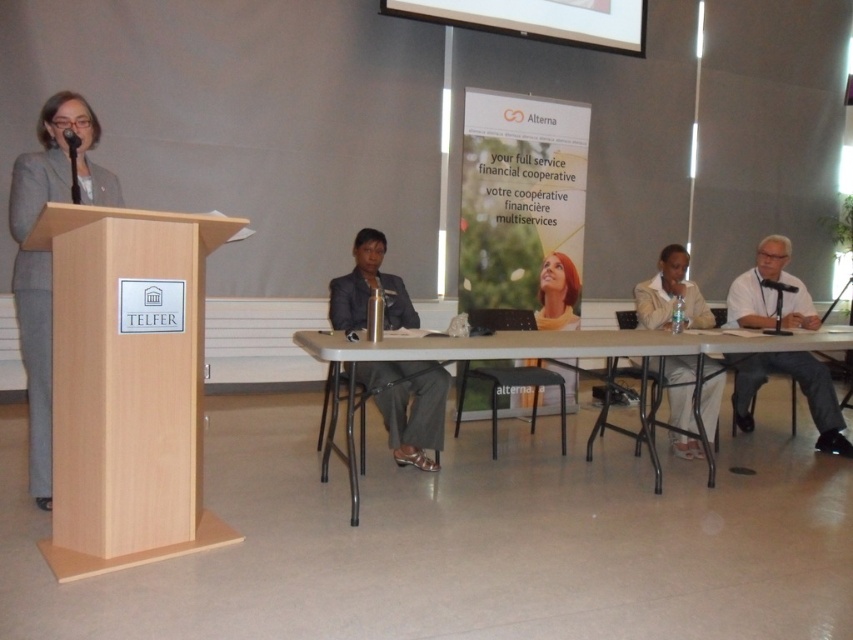
Question: Which of the following is the closest to the observer?

Choices:
 (A) white fabric jacket at center
 (B) white plastic table at center
 (C) blonde hair at center

Answer: (B)

Question: Considering the relative positions of black fabric business suit at center and blonde hair at center in the image provided, where is black fabric business suit at center located with respect to blonde hair at center?

Choices:
 (A) right
 (B) left

Answer: (B)

Question: Is white shirt at right in front of black fabric business suit at center?

Choices:
 (A) yes
 (B) no

Answer: (B)

Question: Which object is positioned closest to the white plastic table at center?

Choices:
 (A) black fabric business suit at center
 (B) light wood podium at left
 (C) blonde hair at center

Answer: (A)

Question: Which of the following is the closest to the observer?

Choices:
 (A) pyautogui.click(x=550, y=321)
 (B) pyautogui.click(x=550, y=332)
 (C) pyautogui.click(x=386, y=285)

Answer: (B)

Question: Is light wood podium at left smaller than white fabric jacket at center?

Choices:
 (A) yes
 (B) no

Answer: (B)